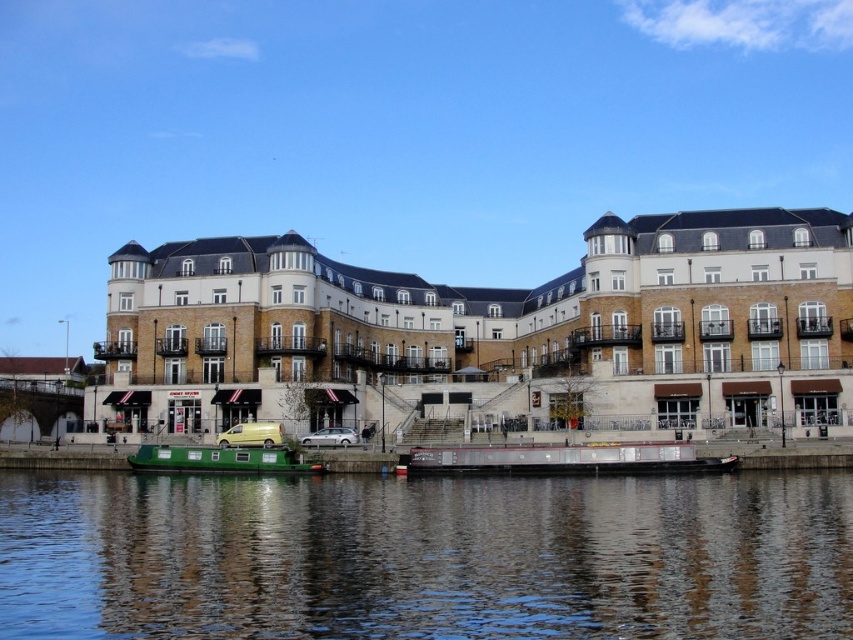
You are a delivery driver who needs to park your metallic yellow van at center without blocking the entrance of the white stone building at center. Based on the scene, can you safely park the van there considering their sizes?

The white stone building at center is taller than the metallic yellow van at center, but this does not indicate their widths. Since the van might still fit widthwise if there is enough space along the riverbank, you should check the available space before parking.

You are standing on the green painted wooden barge at center and want to walk to the white stone building at center. The bridge nearby has a clearance of 75 feet. Can you reach the building without moving the barge?

The distance between the white stone building at center and the green painted wooden barge at center is 76.63 feet. Since the bridge has a clearance of 75 feet, you cannot reach the building without moving the barge because the distance exceeds the bridge clearance.

You are standing on the riverbank and want to take a photo of the waterfront scene. If you want to include both the green matte boat at lower left and the metallic yellow van at center in your photo, which one should you focus on first to ensure both are in frame?

You should focus on the green matte boat at lower left first because it is closer to you than the metallic yellow van at center, so adjusting the frame to include it will naturally include the van as well.